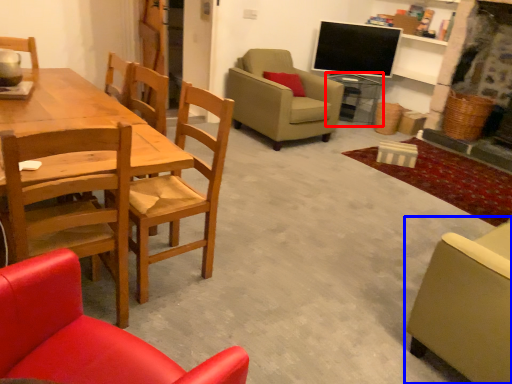
Question: Which object is further to the camera taking this photo, side table (highlighted by a red box) or chair (highlighted by a blue box)?

Choices:
 (A) side table
 (B) chair

Answer: (A)